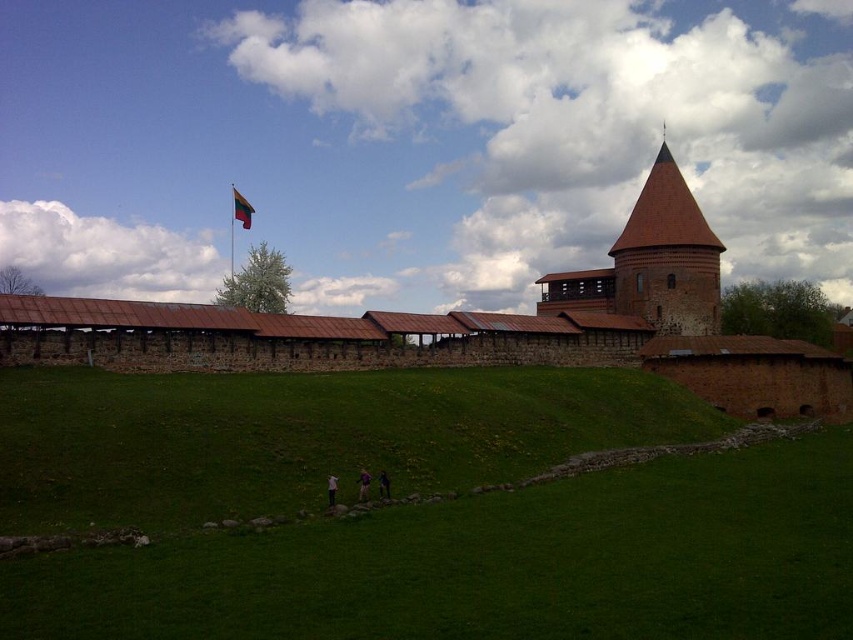
Question: Does brown stone castle at center have a lesser width compared to purple fabric at lower center?

Choices:
 (A) yes
 (B) no

Answer: (B)

Question: Which point is farther to the camera?

Choices:
 (A) dark blue jeans at lower center
 (B) white fabric shirt at lower center
 (C) green grassy hill at lower center
 (D) brown stone castle at center

Answer: (D)

Question: Which point appears closest to the camera in this image?

Choices:
 (A) (410, 349)
 (B) (703, 307)
 (C) (381, 484)
 (D) (231, 211)

Answer: (C)

Question: Can you confirm if green grassy hill at lower center is bigger than dark blue jeans at lower center?

Choices:
 (A) yes
 (B) no

Answer: (A)

Question: Among these points, which one is nearest to the camera?

Choices:
 (A) (468, 349)
 (B) (706, 317)
 (C) (367, 496)

Answer: (C)

Question: Is purple fabric at lower center to the left of dark blue jeans at lower center from the viewer's perspective?

Choices:
 (A) yes
 (B) no

Answer: (A)